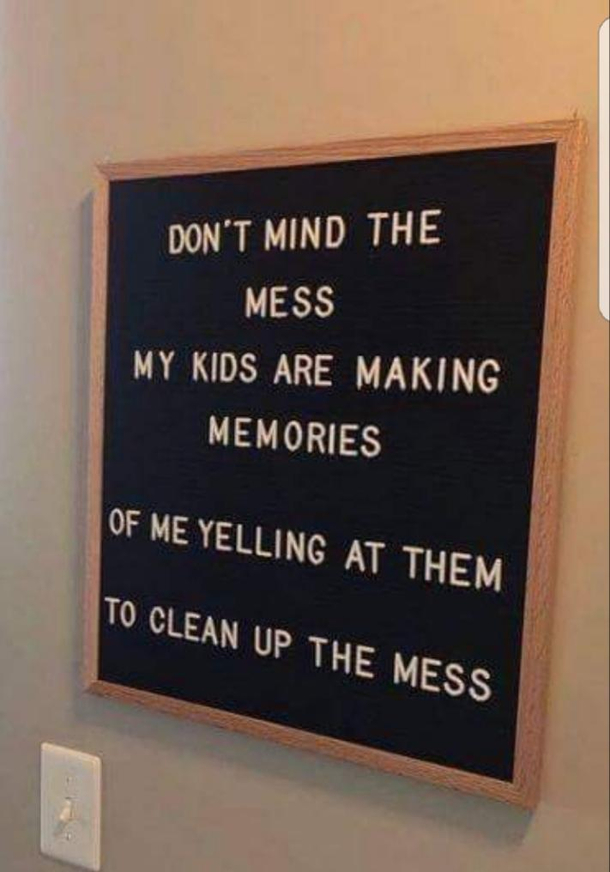
You are a GUI agent. You are given a task and a screenshot of the screen. Output one action in this format:
    pyautogui.click(x=<x>, y=<y>)
    Task: Click on the light swtich
    
    Given the screenshot: What is the action you would take?
    pyautogui.click(x=79, y=804)